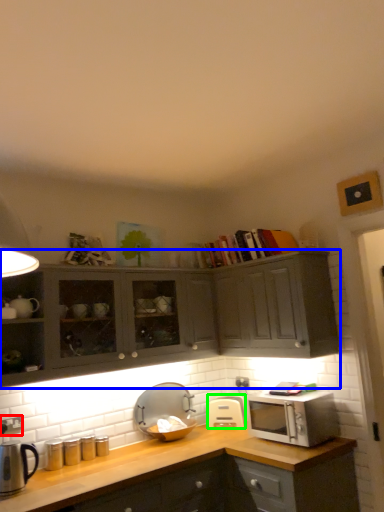
Question: Based on their relative distances, which object is nearer to electric outlet (highlighted by a red box)? Choose from cabinetry (highlighted by a blue box) and appliance (highlighted by a green box).

Choices:
 (A) cabinetry
 (B) appliance

Answer: (A)